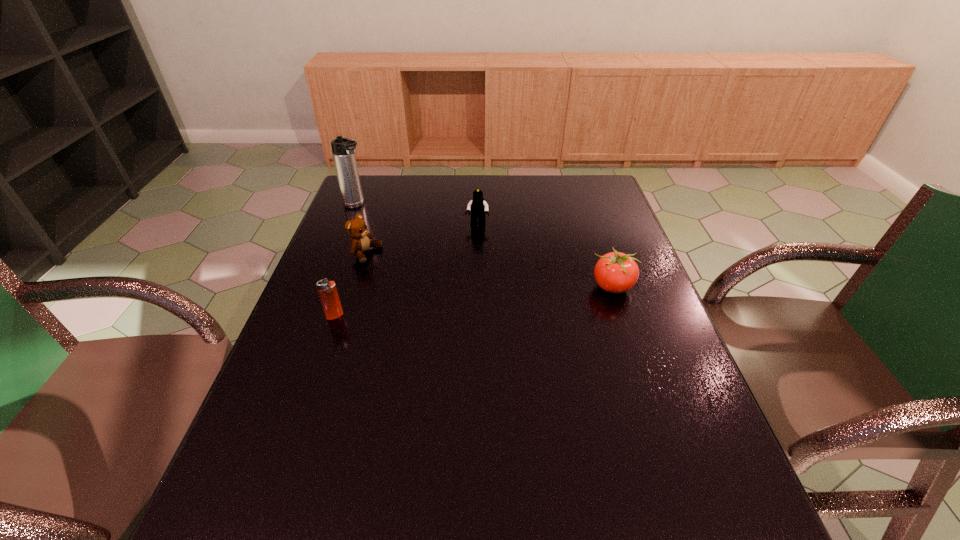
This screenshot has height=540, width=960. Find the location of `free space between the igniter and the farthest object`. free space between the igniter and the farthest object is located at coordinates (346, 261).

Identify the location of object that is the third closest to the third farthest object. The image size is (960, 540). (478, 207).

The image size is (960, 540). Find the location of `object that is the second closest to the fourth nearest object`. object that is the second closest to the fourth nearest object is located at coordinates pyautogui.click(x=343, y=149).

The height and width of the screenshot is (540, 960). In order to click on free space that satisfies the following two spatial constraints: 1. on the back side of the igniter; 2. on the right side of the Lego in this screenshot , I will do `click(366, 225)`.